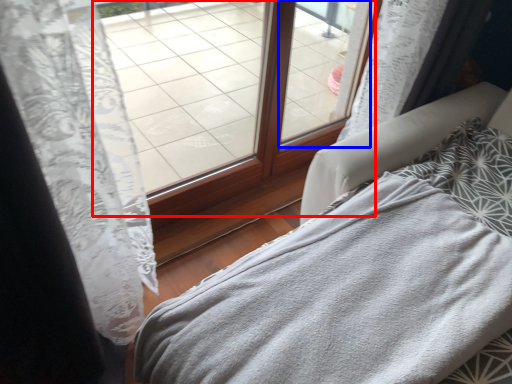
Question: Among these objects, which one is nearest to the camera, window (highlighted by a red box) or window (highlighted by a blue box)?

Choices:
 (A) window
 (B) window

Answer: (A)